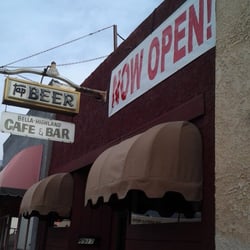
Locate an element on the screen. Image resolution: width=250 pixels, height=250 pixels. entrance is located at coordinates (117, 222).